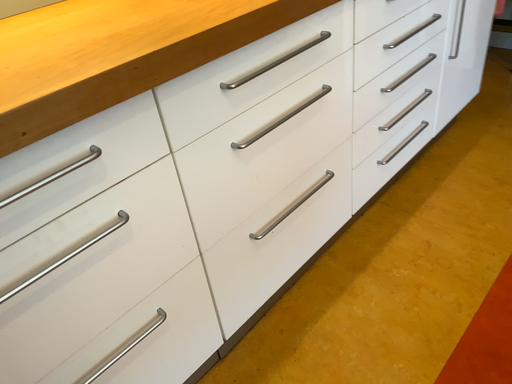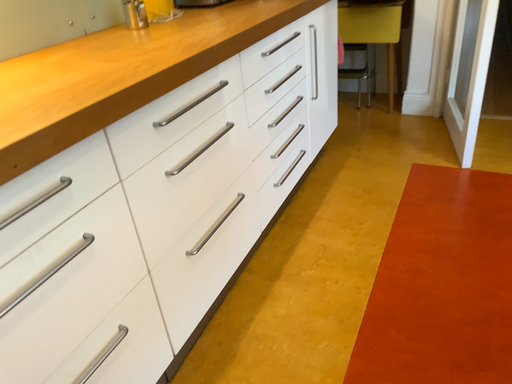
Question: Which way did the camera rotate in the video?

Choices:
 (A) rotated left
 (B) rotated right

Answer: (B)